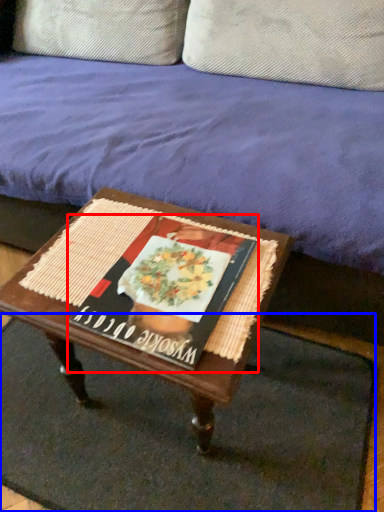
Question: Among these objects, which one is nearest to the camera, magazine (highlighted by a red box) or doormat (highlighted by a blue box)?

Choices:
 (A) magazine
 (B) doormat

Answer: (A)